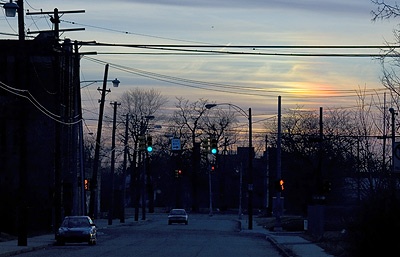
Where is `wires`? The height and width of the screenshot is (257, 400). wires is located at coordinates (69, 124), (140, 44).